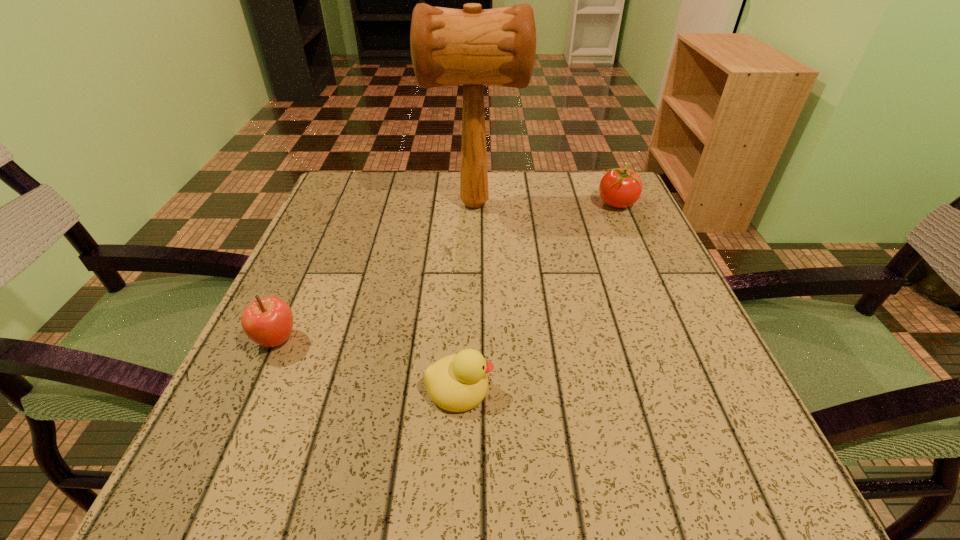
The image size is (960, 540). I want to click on mallet situated at the far edge, so (472, 47).

The height and width of the screenshot is (540, 960). Identify the location of tomato at the far edge. (620, 188).

You are a GUI agent. You are given a task and a screenshot of the screen. Output one action in this format:
    pyautogui.click(x=<x>, y=<y>)
    Task: Click on the object that is at the left edge
    The width and height of the screenshot is (960, 540).
    Given the screenshot: What is the action you would take?
    pyautogui.click(x=268, y=322)

The width and height of the screenshot is (960, 540). What are the coordinates of `object that is at the right edge` in the screenshot? It's located at (620, 188).

At what (x,y) coordinates should I click in order to perform the action: click on object that is at the far right corner. Please return your answer as a coordinate pair (x, y). Looking at the image, I should click on (620, 188).

Locate an element on the screen. vacant space at the far edge of the desktop is located at coordinates coord(411,174).

The height and width of the screenshot is (540, 960). I want to click on free space at the left edge, so click(x=339, y=234).

Locate an element on the screen. The image size is (960, 540). vacant region at the right edge of the desktop is located at coordinates (611, 346).

At what (x,y) coordinates should I click in order to perform the action: click on vacant space at the far left corner. Please return your answer as a coordinate pair (x, y). The image size is (960, 540). Looking at the image, I should click on (372, 205).

At what (x,y) coordinates should I click in order to perform the action: click on vacant space at the near left corner. Please return your answer as a coordinate pair (x, y). Image resolution: width=960 pixels, height=540 pixels. Looking at the image, I should click on (284, 473).